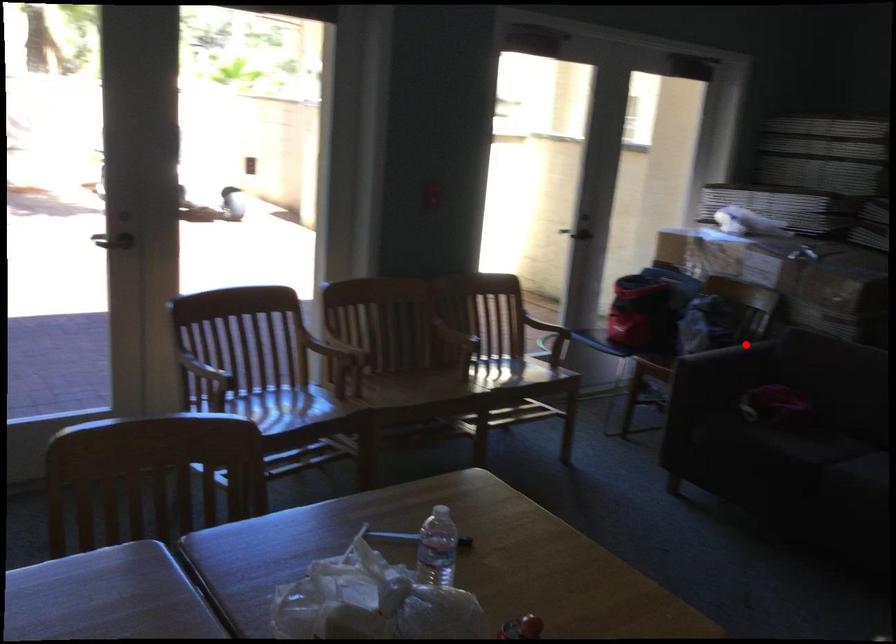
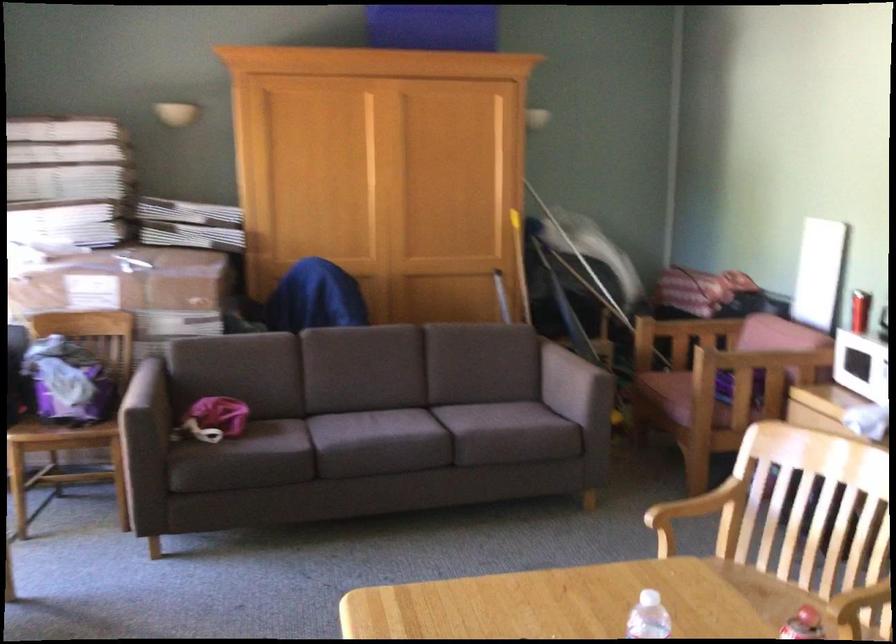
In the second image, find the point that corresponds to the highlighted location in the first image.

(144, 386)